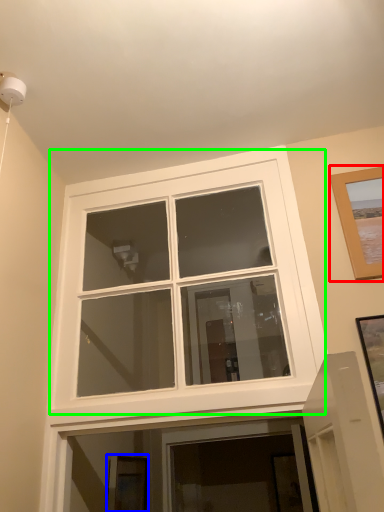
Question: Which object is the farthest from picture frame (highlighted by a red box)? Choose among these: picture frame (highlighted by a blue box) or window (highlighted by a green box).

Choices:
 (A) picture frame
 (B) window

Answer: (A)